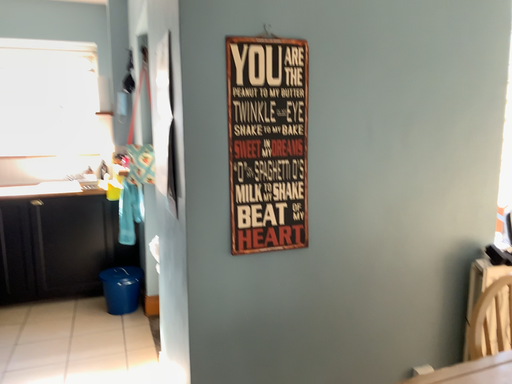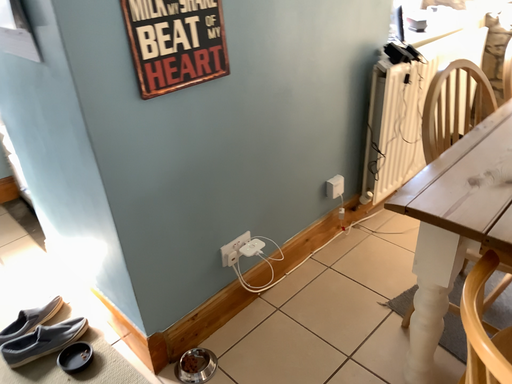
Question: Which way did the camera rotate in the video?

Choices:
 (A) rotated right
 (B) rotated left

Answer: (A)